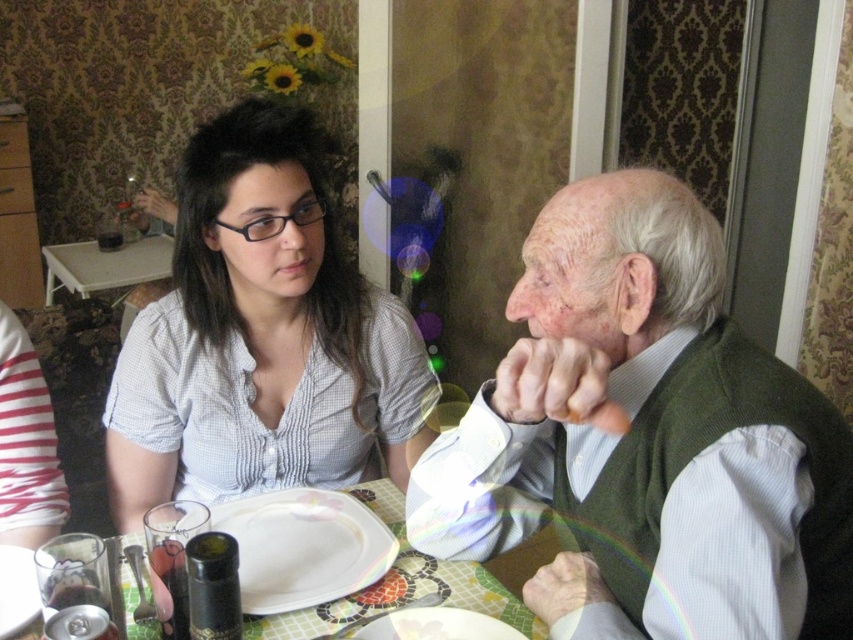
You are a server in a restaurant and need to place a new dish on the table. The dish requires a flat surface to prevent it from tipping over. Which object between the white glossy platter at center and the white glossy plate at center would be more suitable for placing the dish?

The white glossy platter at center is not as tall as the white glossy plate at center, so the platter would be more suitable for placing the dish since it has a flatter surface and is less likely to cause the dish to tip over.

You are an interior designer planning to place a new decorative item on the table in the dining area. The table has a white glossy platter at center. Where should you place the new item so it doesn not block the platter?

Place the new item away from the center of the table, specifically avoiding the area around the coordinates mentioned in the description to ensure it doesn not obstruct the white glossy platter at center.